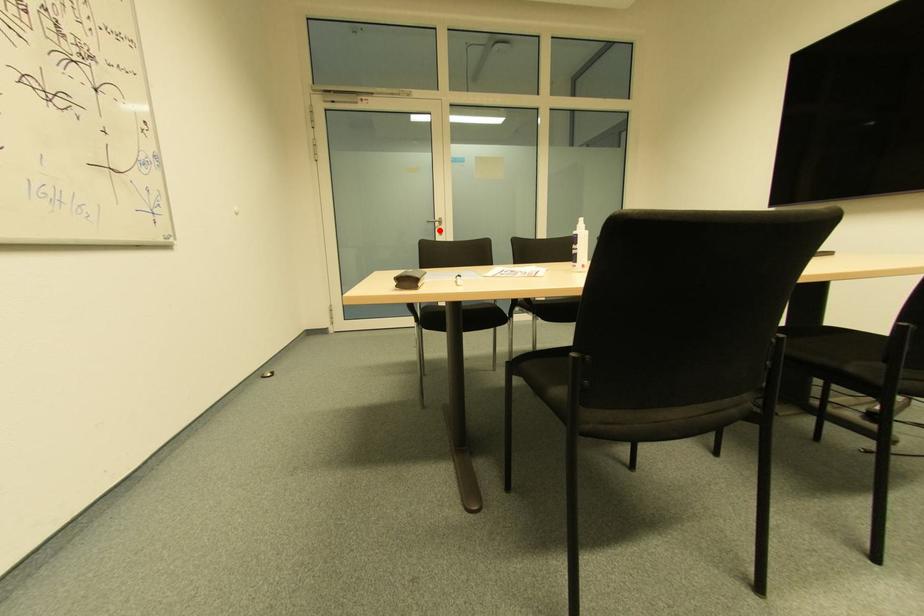
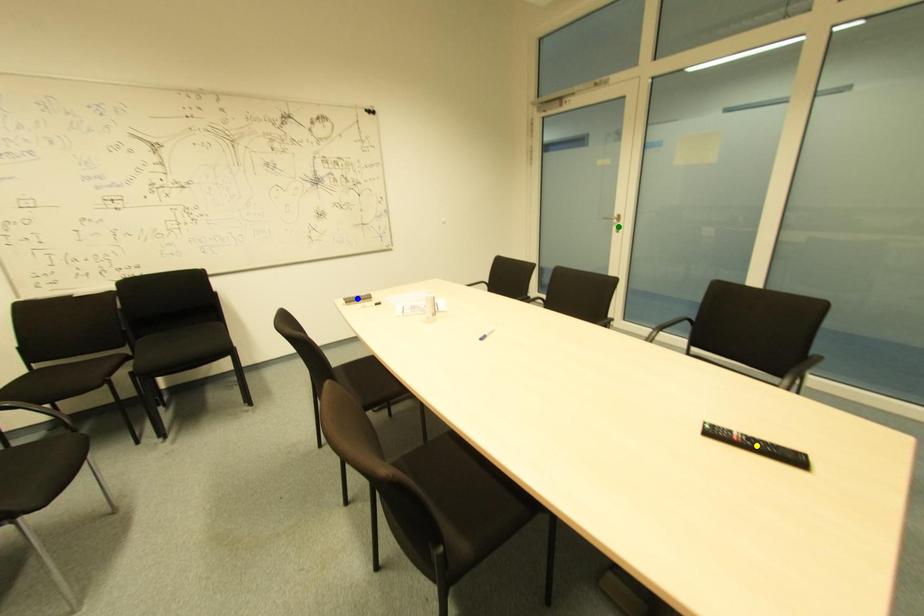
Question: I am providing you with two images of the same scene from different viewpoints. A red point is marked on the first image. You are given multiple points on the second image. Can you choose the point in image 2 that corresponds to the point in image 1?

Choices:
 (A) green point
 (B) yellow point
 (C) blue point

Answer: (A)